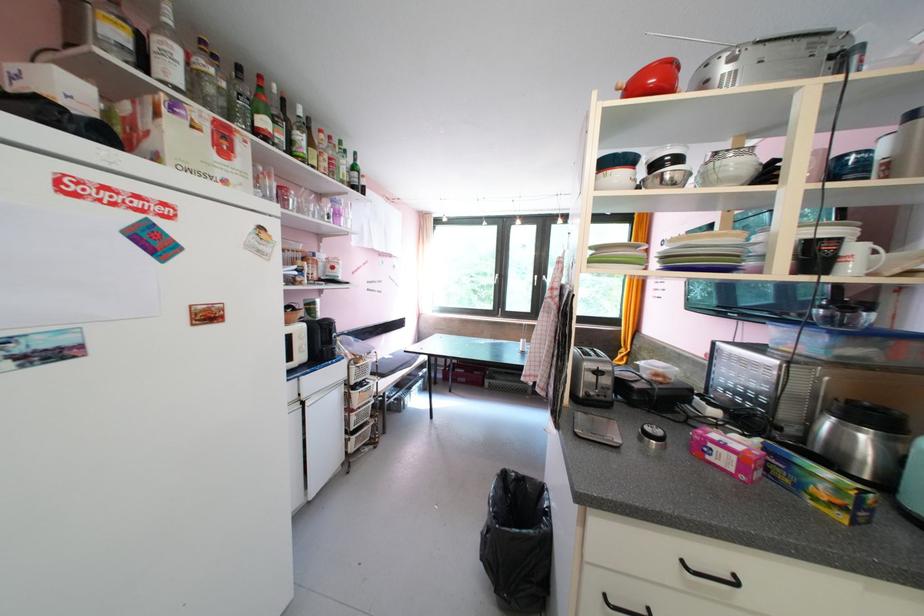
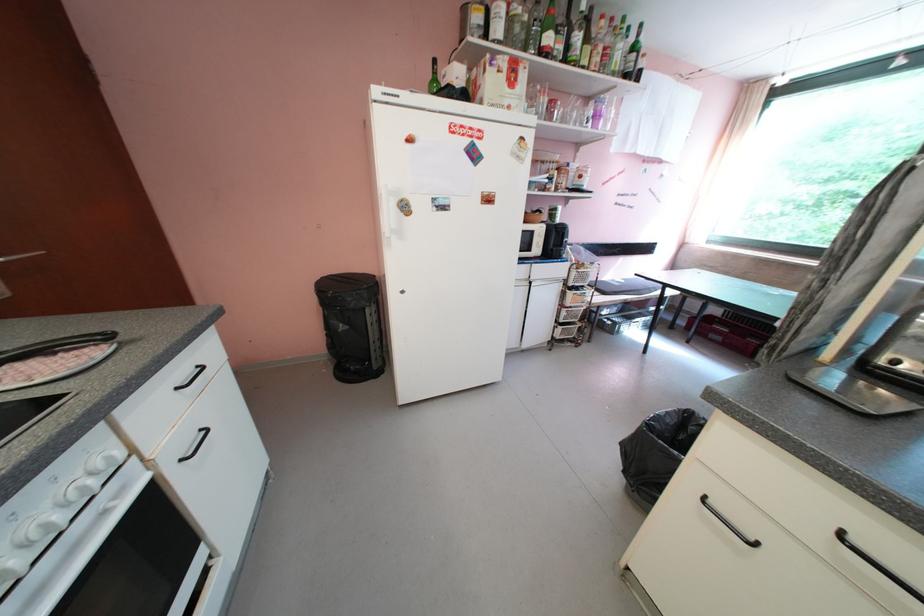
In the second image, find the point that corresponds to the point at 309,212 in the first image.

(572, 122)